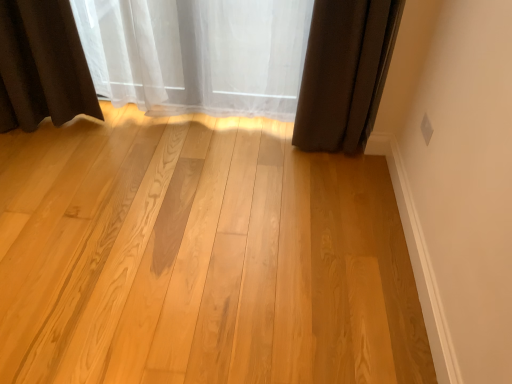
Question: From the image's perspective, is dark brown fabric curtain at upper right, arranged as the second curtain when viewed from the left, located above or below white sheer curtain at upper center, arranged as the 2th curtain when viewed from the right?

Choices:
 (A) below
 (B) above

Answer: (A)

Question: Considering the positions of dark brown fabric curtain at upper right, arranged as the second curtain when viewed from the left, and white sheer curtain at upper center, arranged as the 2th curtain when viewed from the right, in the image, is dark brown fabric curtain at upper right, arranged as the second curtain when viewed from the left, bigger or smaller than white sheer curtain at upper center, arranged as the 2th curtain when viewed from the right,?

Choices:
 (A) small
 (B) big

Answer: (A)

Question: Estimate the real-world distances between objects in this image. Which object is farther from the white sheer curtain at upper center, arranged as the first curtain when viewed from the left?

Choices:
 (A) dark brown fabric curtain at upper right, arranged as the second curtain when viewed from the left
 (B) light wood plank at center

Answer: (B)

Question: Which is farther from the white sheer curtain at upper center, arranged as the 2th curtain when viewed from the right?

Choices:
 (A) dark brown fabric curtain at upper right, arranged as the second curtain when viewed from the left
 (B) light wood plank at center

Answer: (B)